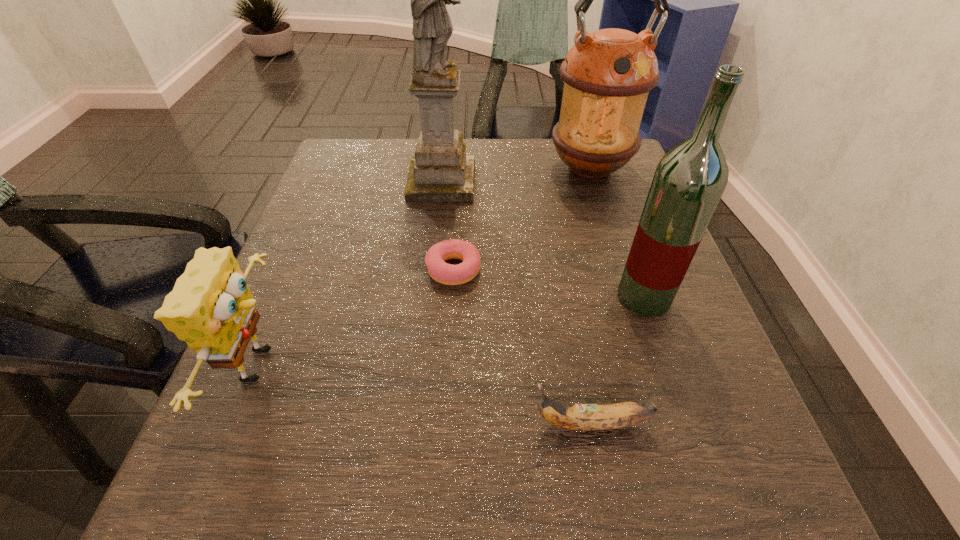
This screenshot has width=960, height=540. Find the location of `empty location between the fourth tallest object and the oil lamp`. empty location between the fourth tallest object and the oil lamp is located at coordinates (426, 267).

Find the location of a particular element. This screenshot has height=540, width=960. empty space between the second shortest object and the liquor is located at coordinates tap(617, 360).

Where is `free space between the leftmost object and the banana`? The width and height of the screenshot is (960, 540). free space between the leftmost object and the banana is located at coordinates (426, 394).

This screenshot has width=960, height=540. I want to click on free area in between the tallest object and the doughnut, so click(447, 226).

At what (x,y) coordinates should I click in order to perform the action: click on free space between the oil lamp and the third shortest object. Please return your answer as a coordinate pair (x, y). Looking at the image, I should click on (426, 267).

Identify the location of free space that is in between the shortest object and the leftmost object. (358, 317).

You are a GUI agent. You are given a task and a screenshot of the screen. Output one action in this format:
    pyautogui.click(x=<x>, y=<y>)
    Task: Click on the free spot between the shortest object and the sponge
    The width and height of the screenshot is (960, 540).
    Given the screenshot: What is the action you would take?
    pyautogui.click(x=358, y=317)

This screenshot has height=540, width=960. In order to click on object that stands as the closest to the doughnut in this screenshot , I will do `click(440, 171)`.

In order to click on the fifth closest object to the banana in this screenshot , I will do `click(607, 74)`.

You are a GUI agent. You are given a task and a screenshot of the screen. Output one action in this format:
    pyautogui.click(x=<x>, y=<y>)
    Task: Click on the free space that satisfies the following two spatial constraints: 1. on the front-facing side of the doughnut; 2. on the left side of the sculpture
    The width and height of the screenshot is (960, 540).
    Given the screenshot: What is the action you would take?
    pyautogui.click(x=433, y=269)